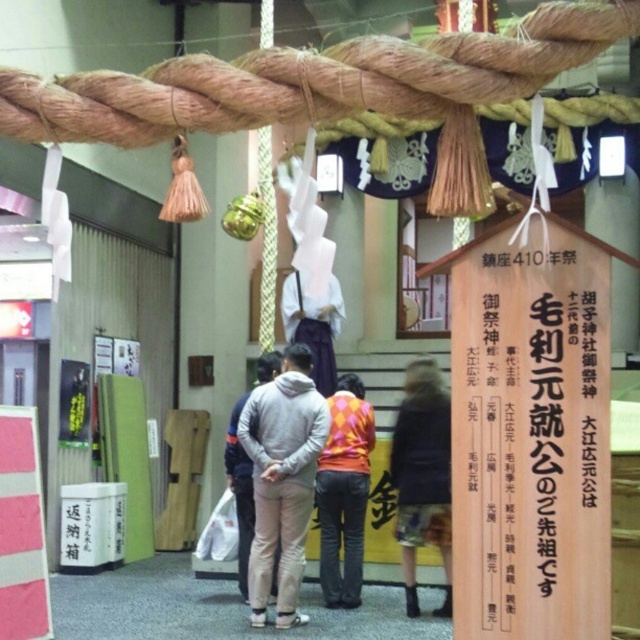
Which is below, gray fleece sweatshirt at center or gray fleece jacket at center?

gray fleece jacket at center is below.

Is gray fleece sweatshirt at center further to the viewer compared to gray fleece jacket at center?

No, gray fleece sweatshirt at center is in front of gray fleece jacket at center.

Who is more forward, (256, 600) or (240, 464)?

Point (256, 600)

The height and width of the screenshot is (640, 640). What are the coordinates of `gray fleece sweatshirt at center` in the screenshot? It's located at (282, 481).

Which of these two, dark blue fabric skirt at lower center or gray fleece jacket at center, stands shorter?

Standing shorter between the two is dark blue fabric skirt at lower center.

Is dark blue fabric skirt at lower center to the right of gray fleece jacket at center from the viewer's perspective?

Yes, dark blue fabric skirt at lower center is to the right of gray fleece jacket at center.

Where is `dark blue fabric skirt at lower center`? dark blue fabric skirt at lower center is located at coordinates (422, 476).

Image resolution: width=640 pixels, height=640 pixels. I want to click on dark blue fabric skirt at lower center, so click(x=422, y=476).

Is gray fleece sweatshirt at center taller than orange diamond-patterned sweater at center?

Yes, gray fleece sweatshirt at center is taller than orange diamond-patterned sweater at center.

From the picture: Between gray fleece sweatshirt at center and orange diamond-patterned sweater at center, which one has less height?

Standing shorter between the two is orange diamond-patterned sweater at center.

Who is more forward, (276, 586) or (358, 419)?

Point (276, 586) is more forward.

Find the location of a particular element. The height and width of the screenshot is (640, 640). gray fleece sweatshirt at center is located at coordinates (282, 481).